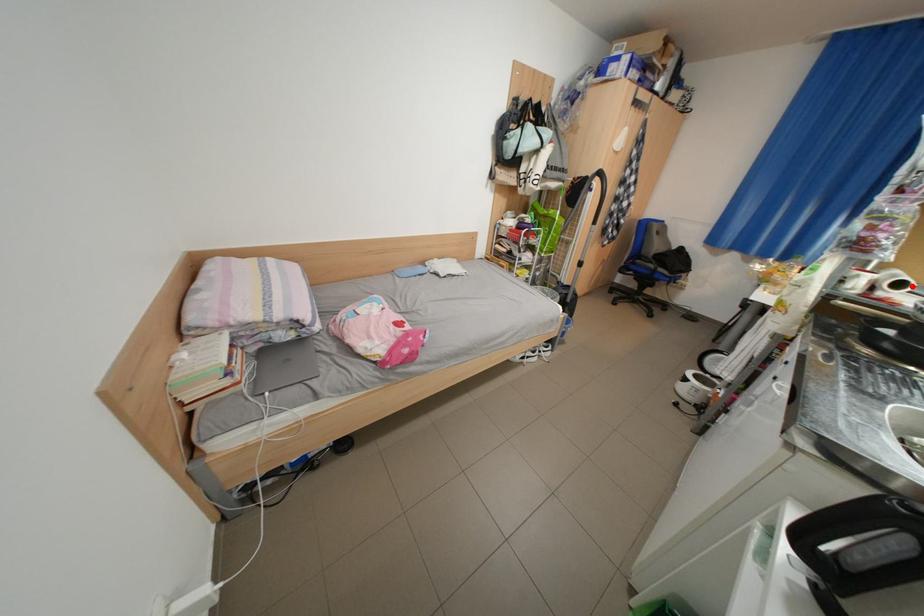
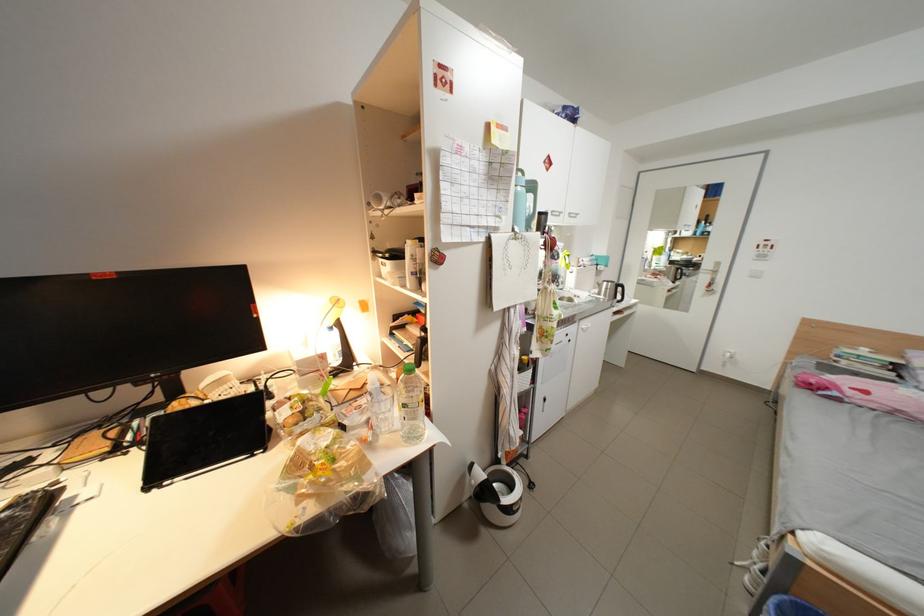
Question: I am providing you with two images of the same scene from different viewpoints. A red point is marked on the first image. Is the red point's position out of view in image 2?

Choices:
 (A) Yes
 (B) No

Answer: (A)